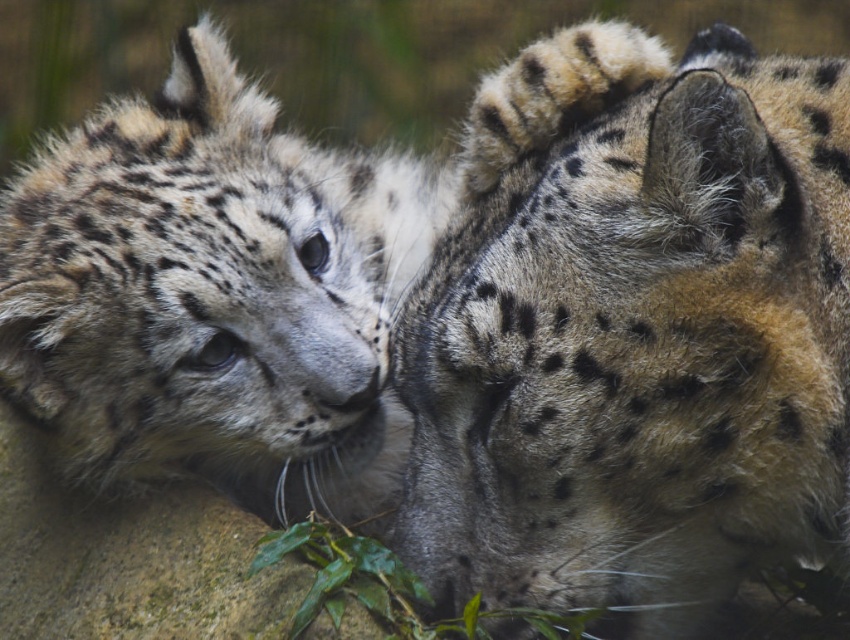
Question: Can you confirm if spotted fur cheetah at center is bigger than spotted fur snow leopard at left?

Choices:
 (A) yes
 (B) no

Answer: (B)

Question: Does spotted fur cheetah at center come behind spotted fur snow leopard at left?

Choices:
 (A) no
 (B) yes

Answer: (A)

Question: Is spotted fur cheetah at center closer to the viewer compared to spotted fur snow leopard at left?

Choices:
 (A) no
 (B) yes

Answer: (B)

Question: Which point is closer to the camera?

Choices:
 (A) spotted fur snow leopard at left
 (B) spotted fur cheetah at center

Answer: (B)

Question: Which object appears farthest from the camera in this image?

Choices:
 (A) spotted fur cheetah at center
 (B) spotted fur snow leopard at left

Answer: (B)